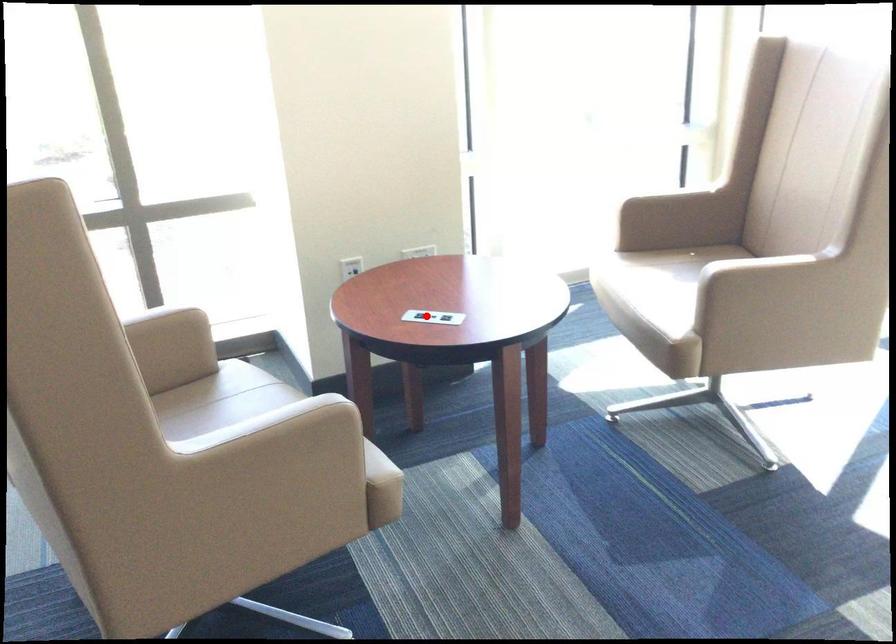
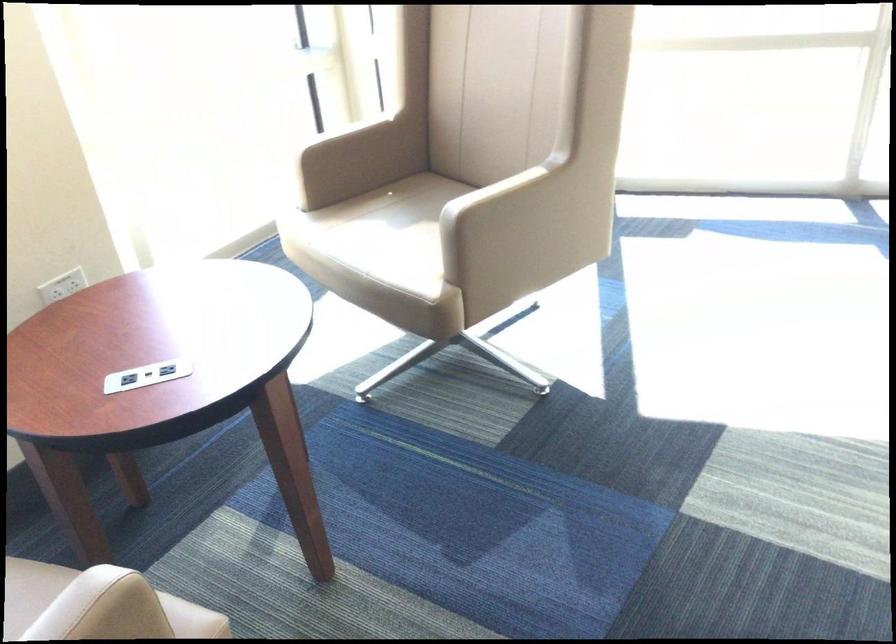
Find the pixel in the second image that matches the highlighted location in the first image.

(147, 375)